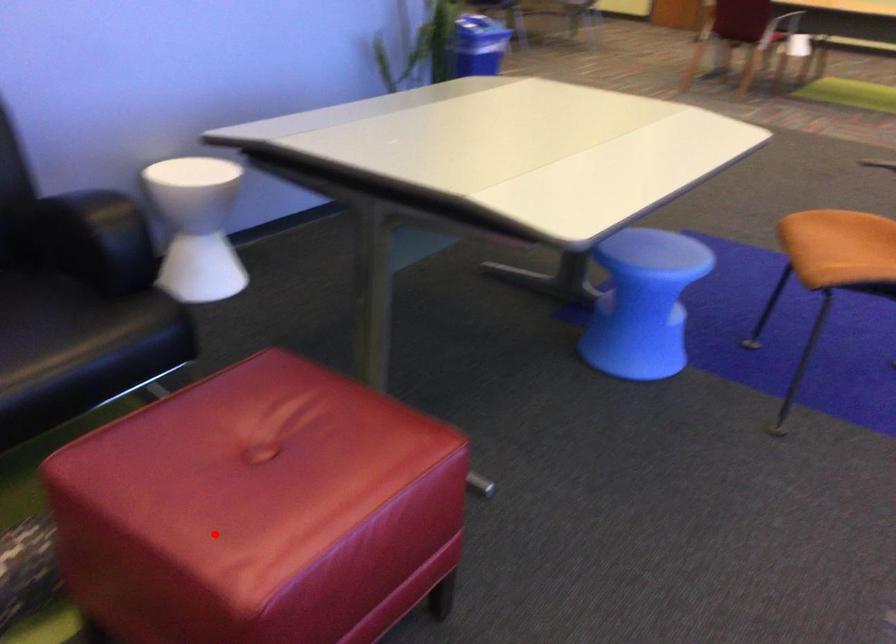
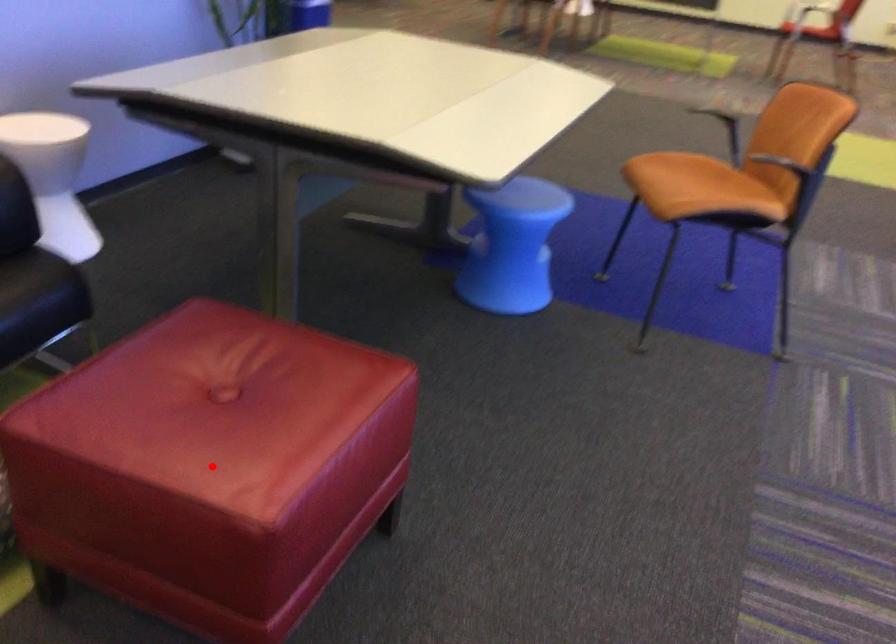
I am providing you with two images of the same scene from different viewpoints. A red point is marked on the first image and another point is marked on the second image. Do the highlighted points in image1 and image2 indicate the same real-world spot?

Yes